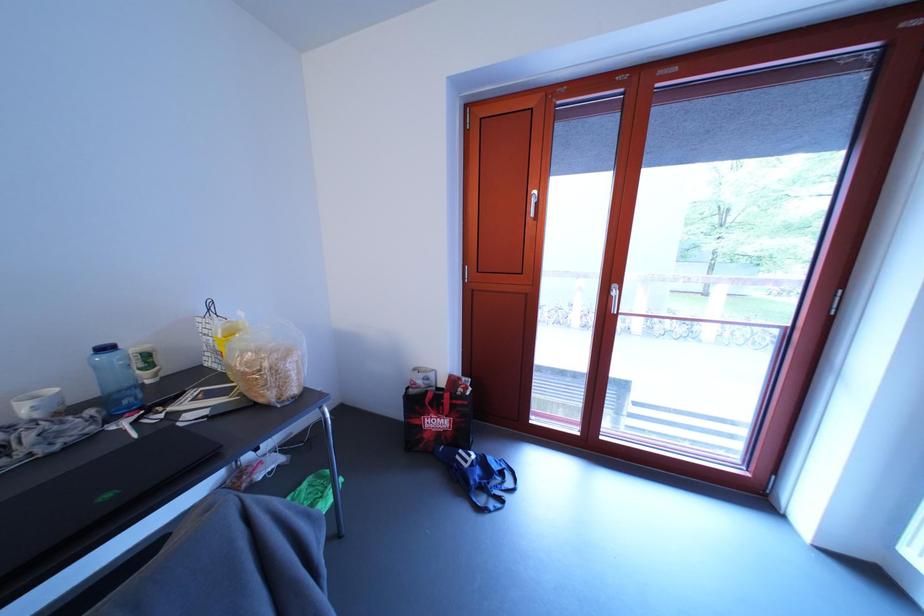
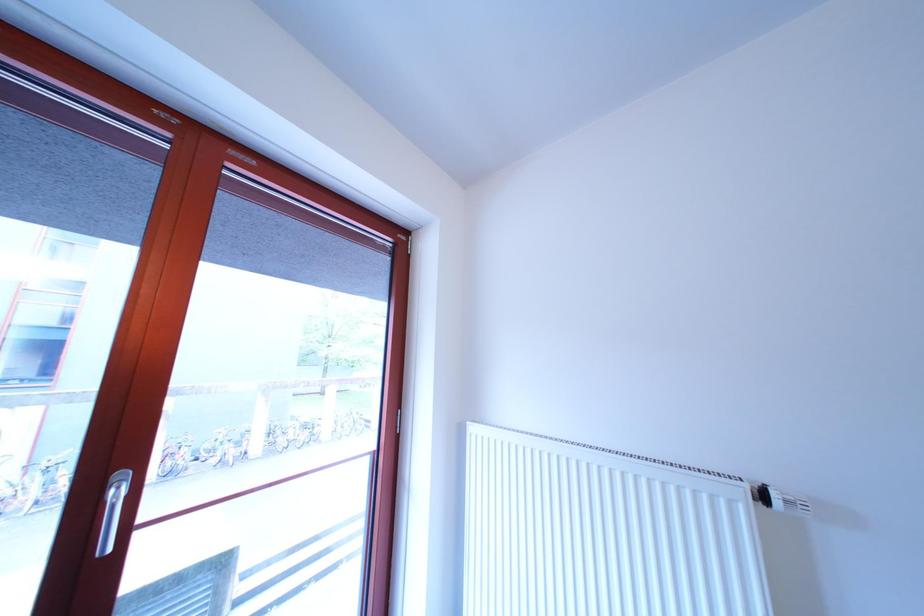
Question: The camera is either moving clockwise (left) or counter-clockwise (right) around the object. The first image is from the beginning of the video and the second image is from the end. Is the camera moving left or right when shooting the video?

Choices:
 (A) Left
 (B) Right

Answer: (A)